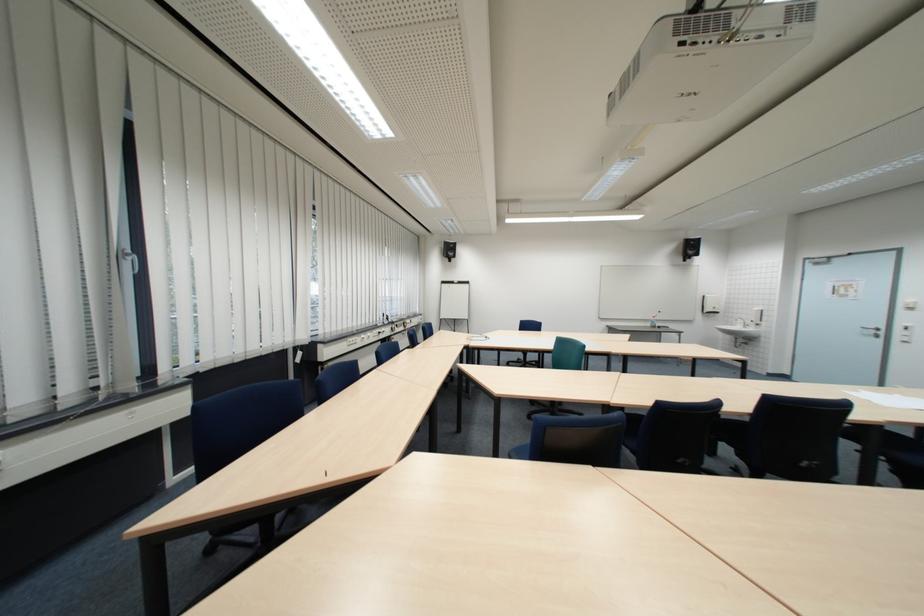
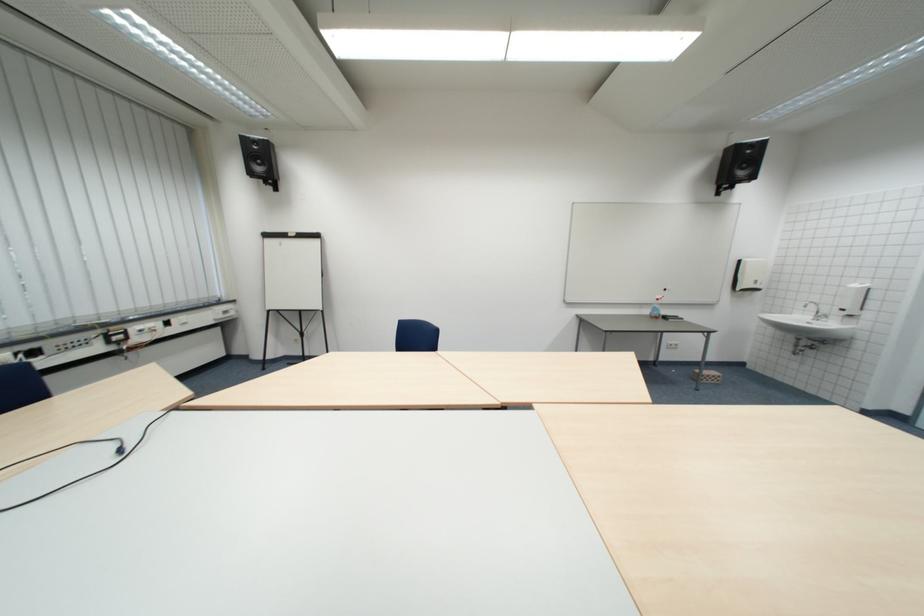
The images are taken continuously from a first-person perspective. In which direction are you moving?

The cameraman moved toward right, forward.